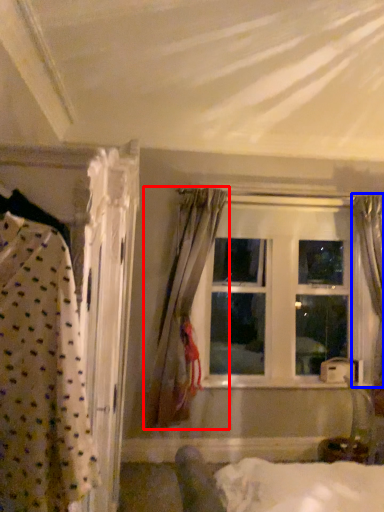
Question: Which of the following is the closest to the observer, curtain (highlighted by a red box) or curtain (highlighted by a blue box)?

Choices:
 (A) curtain
 (B) curtain

Answer: (A)